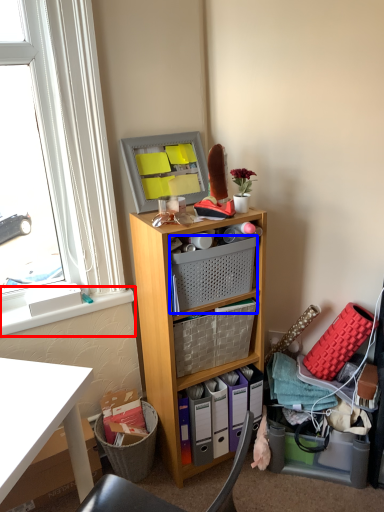
Question: Among these objects, which one is farthest to the camera, window sill (highlighted by a red box) or basket (highlighted by a blue box)?

Choices:
 (A) window sill
 (B) basket

Answer: (A)